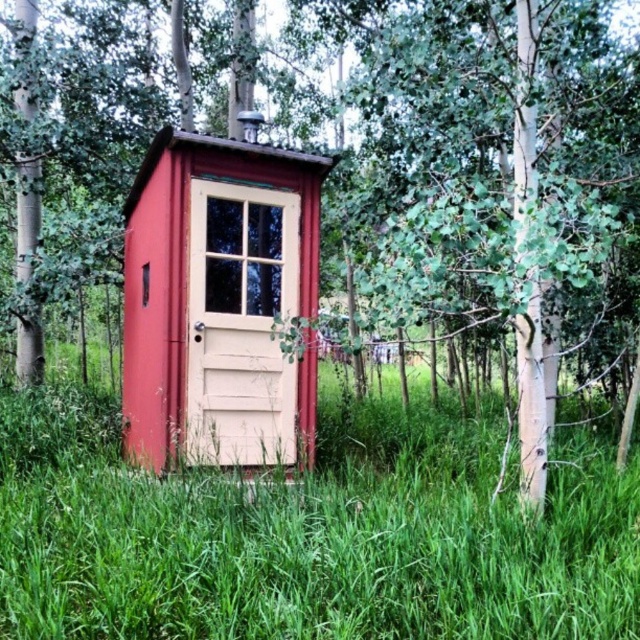
Question: Is green grass at center bigger than matte wood cabin at center?

Choices:
 (A) no
 (B) yes

Answer: (A)

Question: Which point appears farthest from the camera in this image?

Choices:
 (A) (432, 449)
 (B) (195, 413)

Answer: (A)

Question: From the image, what is the correct spatial relationship of green grass at center in relation to matte wood cabin at center?

Choices:
 (A) below
 (B) above

Answer: (A)

Question: Can you confirm if green grass at center is wider than matte wood cabin at center?

Choices:
 (A) yes
 (B) no

Answer: (A)

Question: Which point is farther from the camera taking this photo?

Choices:
 (A) (312, 282)
 (B) (422, 480)

Answer: (A)